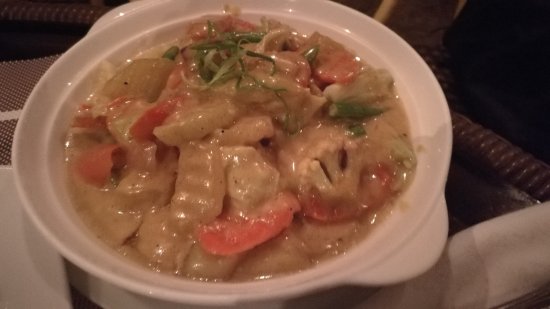
This screenshot has width=550, height=309. In order to click on handle of white bowl in this screenshot , I will do click(x=411, y=251), click(x=129, y=7).